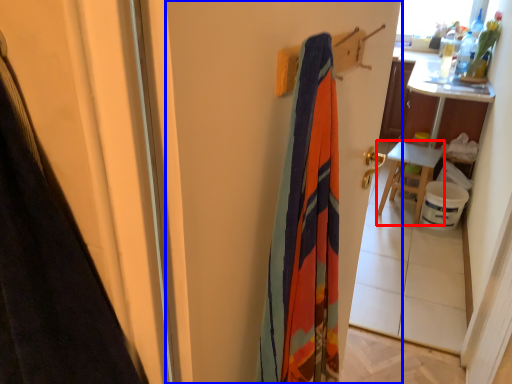
Question: Which of the following is the farthest to the observer, furniture (highlighted by a red box) or screen door (highlighted by a blue box)?

Choices:
 (A) furniture
 (B) screen door

Answer: (A)